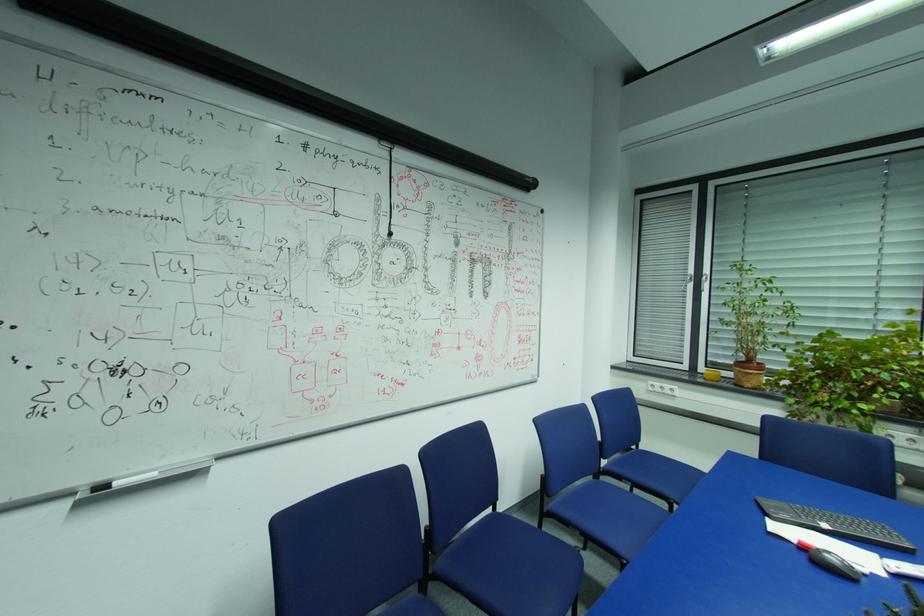
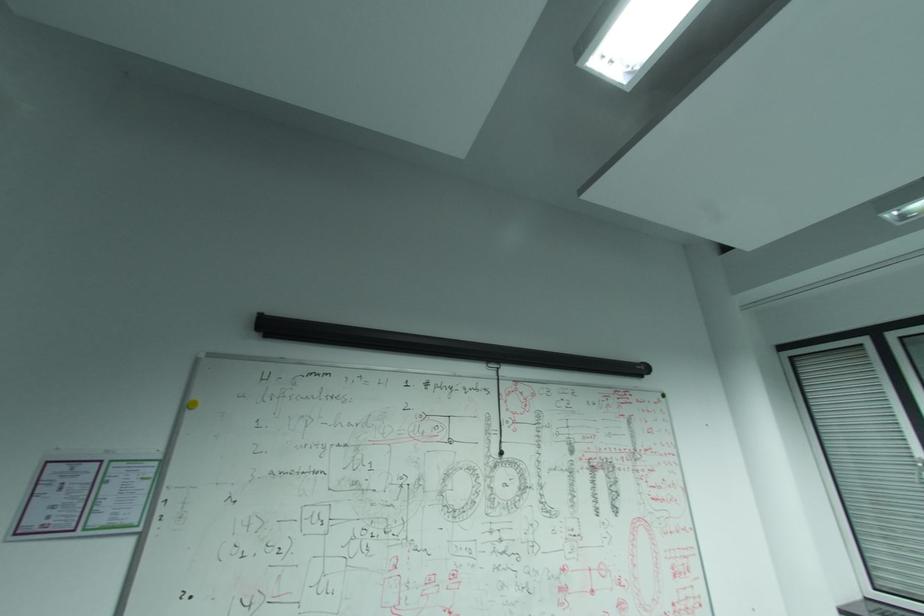
First-person continuous shooting, in which direction is the camera rotating?

The camera rotated toward left-up.